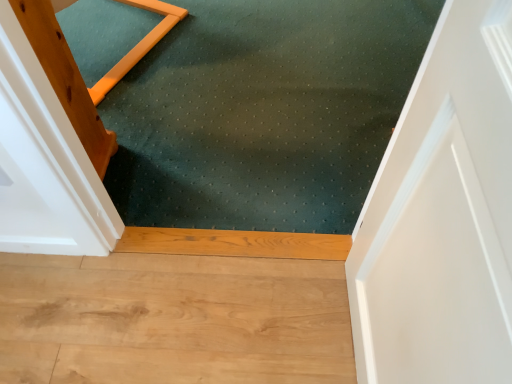
Question: Should I look upward or downward to see green textured mat at center?

Choices:
 (A) down
 (B) up

Answer: (B)

Question: Is light brown wood flooring at lower center completely or partially inside green textured mat at center?

Choices:
 (A) yes
 (B) no

Answer: (B)

Question: Does green textured mat at center have a smaller size compared to light brown wood flooring at lower center?

Choices:
 (A) yes
 (B) no

Answer: (B)

Question: Can you confirm if green textured mat at center is shorter than light brown wood flooring at lower center?

Choices:
 (A) no
 (B) yes

Answer: (B)

Question: Is green textured mat at center turned away from light brown wood flooring at lower center?

Choices:
 (A) no
 (B) yes

Answer: (A)

Question: From the image's perspective, is green textured mat at center under light brown wood flooring at lower center?

Choices:
 (A) no
 (B) yes

Answer: (A)

Question: Is green textured mat at center positioned beyond the bounds of light brown wood flooring at lower center?

Choices:
 (A) yes
 (B) no

Answer: (A)

Question: From a real-world perspective, is light brown wood flooring at lower center positioned under green textured mat at center based on gravity?

Choices:
 (A) no
 (B) yes

Answer: (B)

Question: Does light brown wood flooring at lower center have a larger size compared to green textured mat at center?

Choices:
 (A) no
 (B) yes

Answer: (A)

Question: Does light brown wood flooring at lower center have a greater height compared to green textured mat at center?

Choices:
 (A) no
 (B) yes

Answer: (B)

Question: Is light brown wood flooring at lower center smaller than green textured mat at center?

Choices:
 (A) no
 (B) yes

Answer: (B)

Question: Is light brown wood flooring at lower center turned away from green textured mat at center?

Choices:
 (A) no
 (B) yes

Answer: (A)

Question: Is light brown wood flooring at lower center wider than green textured mat at center?

Choices:
 (A) yes
 (B) no

Answer: (B)

Question: From their relative heights in the image, would you say light brown wood flooring at lower center is taller or shorter than green textured mat at center?

Choices:
 (A) tall
 (B) short

Answer: (A)